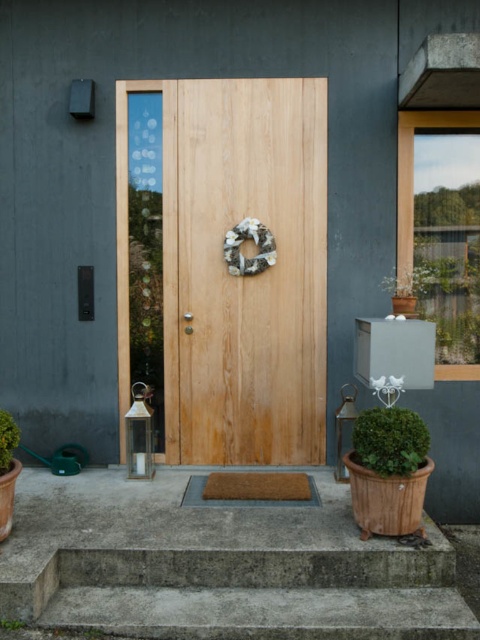
Between point (233, 326) and point (6, 620), which one is positioned in front?

Point (6, 620)

What do you see at coordinates (253, 275) in the screenshot? The height and width of the screenshot is (640, 480). I see `natural wood door at center` at bounding box center [253, 275].

The width and height of the screenshot is (480, 640). I want to click on natural wood door at center, so click(253, 275).

This screenshot has width=480, height=640. I want to click on green matte potted plant at lower right, so click(389, 440).

Can you confirm if green matte potted plant at lower right is taller than green leafy bush at lower left?

Yes.

Does point (364, 424) come behind point (0, 435)?

Yes.

At what (x,y) coordinates should I click in order to perform the action: click on green matte potted plant at lower right. Please return your answer as a coordinate pair (x, y). This screenshot has width=480, height=640. Looking at the image, I should click on (389, 440).

Does natural wood door at center have a greater width compared to green leafy bush at lower left?

Yes.

Does point (252, 344) come closer to viewer compared to point (0, 464)?

No.

I want to click on natural wood door at center, so click(253, 275).